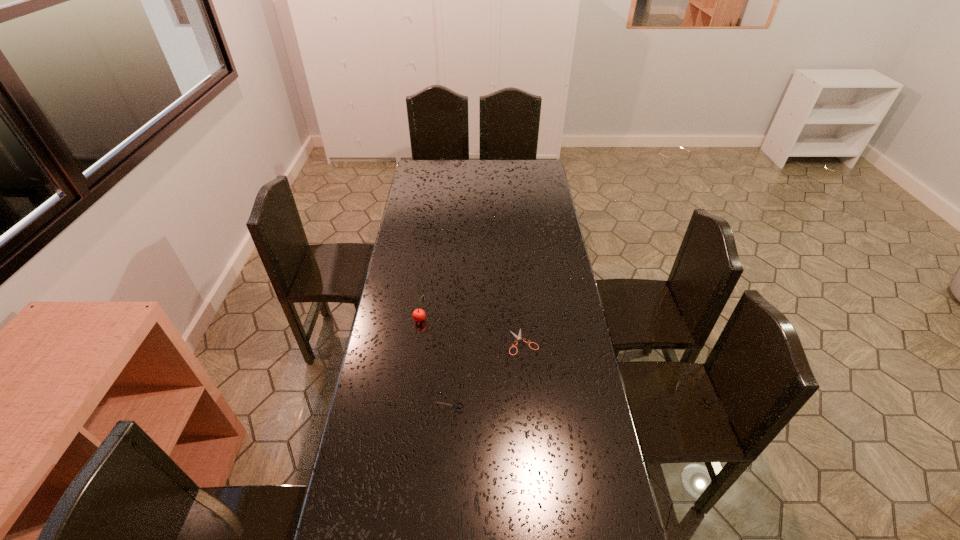
The image size is (960, 540). I want to click on the farthest object, so click(418, 315).

Image resolution: width=960 pixels, height=540 pixels. In order to click on cherry in this screenshot , I will do `click(418, 315)`.

This screenshot has height=540, width=960. I want to click on the second shortest object, so click(x=456, y=406).

I want to click on the nearest object, so click(456, 406).

Where is `the right shears`? This screenshot has width=960, height=540. the right shears is located at coordinates (518, 337).

I want to click on the shortest object, so click(x=518, y=337).

This screenshot has width=960, height=540. In order to click on free space located on the left of the cherry in this screenshot , I will do `click(386, 319)`.

Identify the location of vacant space located 0.280m on the back of the second tallest object. (453, 333).

This screenshot has width=960, height=540. Identify the location of vacant space situated on the back of the shorter shears. (521, 318).

You are a GUI agent. You are given a task and a screenshot of the screen. Output one action in this format:
    pyautogui.click(x=<x>, y=<y>)
    Task: Click on the object situated at the left edge
    This screenshot has width=960, height=540.
    Given the screenshot: What is the action you would take?
    pyautogui.click(x=418, y=315)